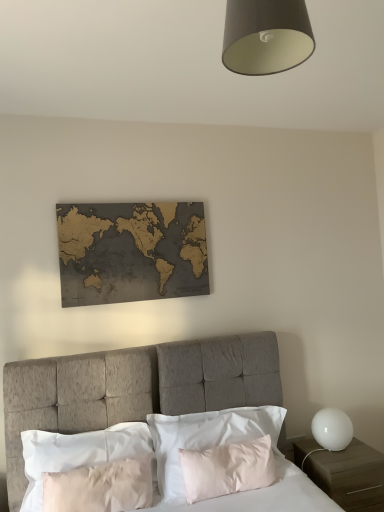
Where is `free spot in front of white matte globe at right`? free spot in front of white matte globe at right is located at coordinates (x=341, y=463).